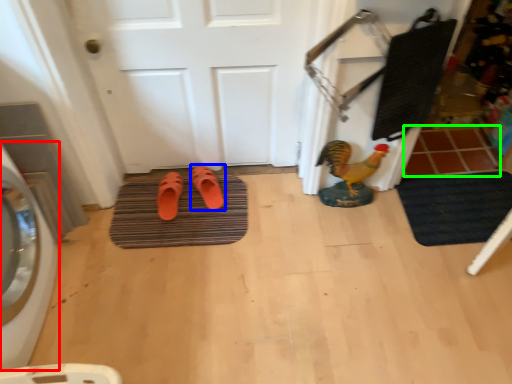
Question: Considering the real-world distances, which object is closest to washing machine (highlighted by a red box)? footwear (highlighted by a blue box) or tile (highlighted by a green box).

Choices:
 (A) footwear
 (B) tile

Answer: (A)